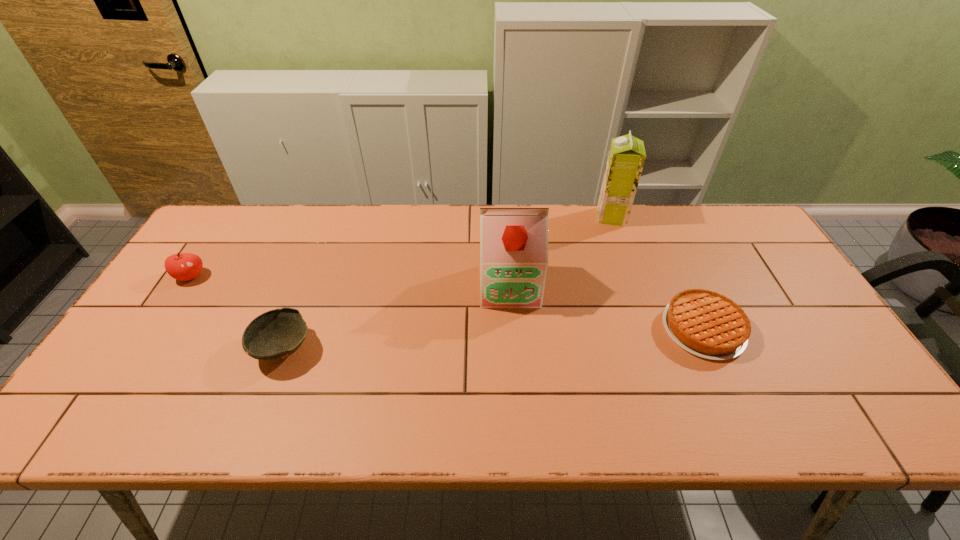
Locate an element on the screen. The width and height of the screenshot is (960, 540). the right soya milk is located at coordinates (626, 158).

At what (x,y) coordinates should I click in order to perform the action: click on the farthest object. Please return your answer as a coordinate pair (x, y). Image resolution: width=960 pixels, height=540 pixels. Looking at the image, I should click on (626, 158).

Identify the location of the third object from right to left. click(513, 241).

The height and width of the screenshot is (540, 960). I want to click on the nearer soya milk, so click(x=513, y=241).

The image size is (960, 540). I want to click on the third shortest object, so click(182, 266).

In order to click on apple in this screenshot , I will do `click(182, 266)`.

Where is `bowl`? This screenshot has height=540, width=960. bowl is located at coordinates (274, 335).

In order to click on the fourth object from right to left in this screenshot , I will do `click(274, 335)`.

I want to click on pie, so click(x=709, y=325).

At what (x,y) coordinates should I click in order to perform the action: click on free region located on the front of the farther soya milk. Please return your answer as a coordinate pair (x, y). Image resolution: width=960 pixels, height=540 pixels. Looking at the image, I should click on (625, 258).